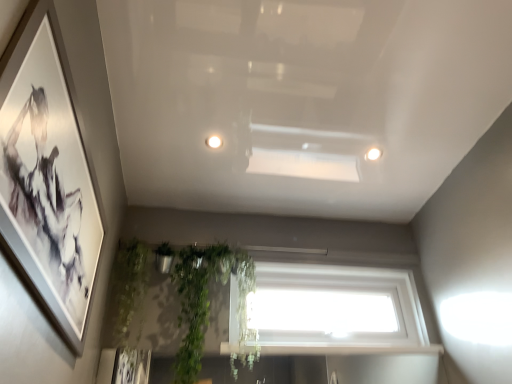
Question: Considering their positions, is white glossy light fixture at center, the second lighting from the right, located in front of or behind transparent glass window at center?

Choices:
 (A) behind
 (B) front

Answer: (B)

Question: From the image's perspective, is white glossy light fixture at center, the first lighting positioned from the top, above or below transparent glass window at center?

Choices:
 (A) above
 (B) below

Answer: (A)

Question: Estimate the real-world distances between objects in this image. Which object is closer to the white glossy light fixture at center, which is the 1th lighting from left to right?

Choices:
 (A) white glossy light fixture at upper right, the 1th lighting from the right
 (B) white glossy window sill at lower center
 (C) matte black picture frame at left
 (D) green leafy plant at lower left
 (E) transparent glass window at center

Answer: (A)

Question: Considering the real-world distances, which object is closest to the matte black picture frame at left?

Choices:
 (A) white glossy light fixture at upper right, the 2th lighting in the top-to-bottom sequence
 (B) white glossy light fixture at center, the first lighting in the front-to-back sequence
 (C) transparent glass window at center
 (D) white glossy window sill at lower center
 (E) green leafy plant at lower left

Answer: (E)